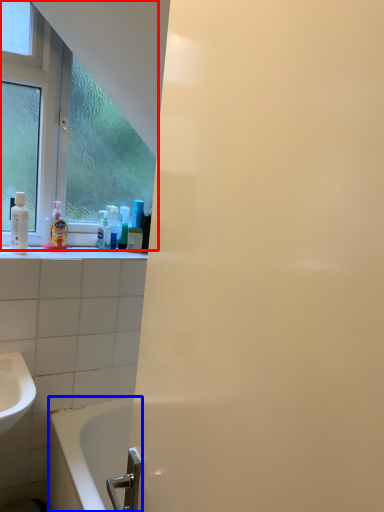
Question: Which of the following is the farthest to the observer, window (highlighted by a red box) or bathtub (highlighted by a blue box)?

Choices:
 (A) window
 (B) bathtub

Answer: (A)